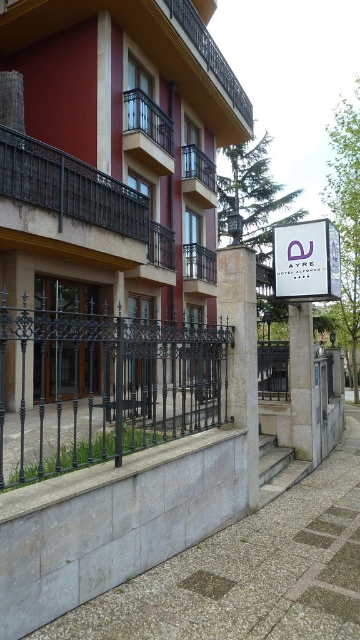
You are a delivery person trying to park a van that is 2 meters wide. You see the matte brown building at center and the white concrete pillar at center. Can you fit your van between them?

The matte brown building at center might be wider than the white concrete pillar at center, so there is uncertainty about the available space. It is safer to assume the van may not fit and look for another parking spot.

You are standing on the walkway in front of the Ayre Hotel Alfonso I. You see a purple glossy sign at center and a white concrete pillar at center. Which object is nearer to you?

The purple glossy sign at center is closer to the viewer than the white concrete pillar at center.

You are standing on the walkway in front of the Ayre Hotel Alfonso I. You see the matte brown building at center and the white concrete pillar at center. Which object is directly above the other?

The matte brown building at center is positioned over the white concrete pillar at center, so the building is directly above the pillar.